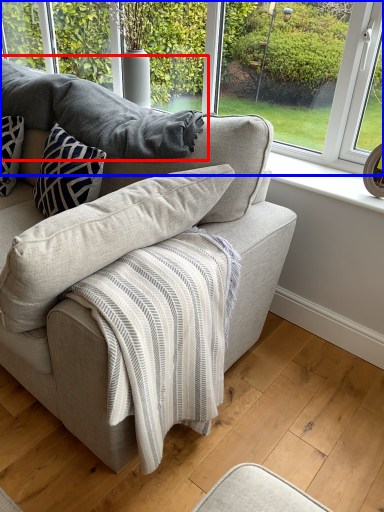
Question: Which object appears farthest to the camera in this image, gray (highlighted by a red box) or window (highlighted by a blue box)?

Choices:
 (A) gray
 (B) window

Answer: (B)